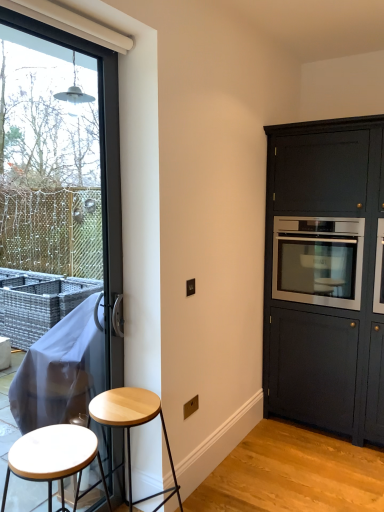
Locate an element on the screen. The height and width of the screenshot is (512, 384). vacant region above white matte stool at lower left, arranged as the 2th stool when viewed from the back (from a real-world perspective) is located at coordinates (49, 453).